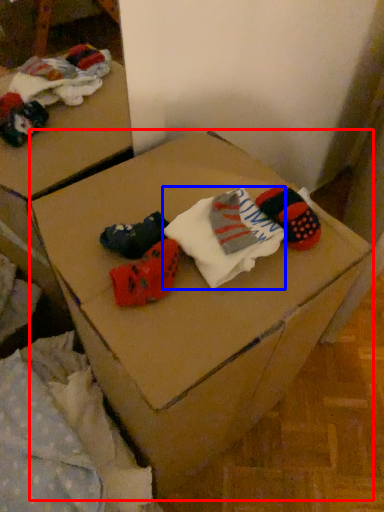
Question: Which point is further to the camera, furniture (highlighted by a red box) or sock (highlighted by a blue box)?

Choices:
 (A) furniture
 (B) sock

Answer: (B)